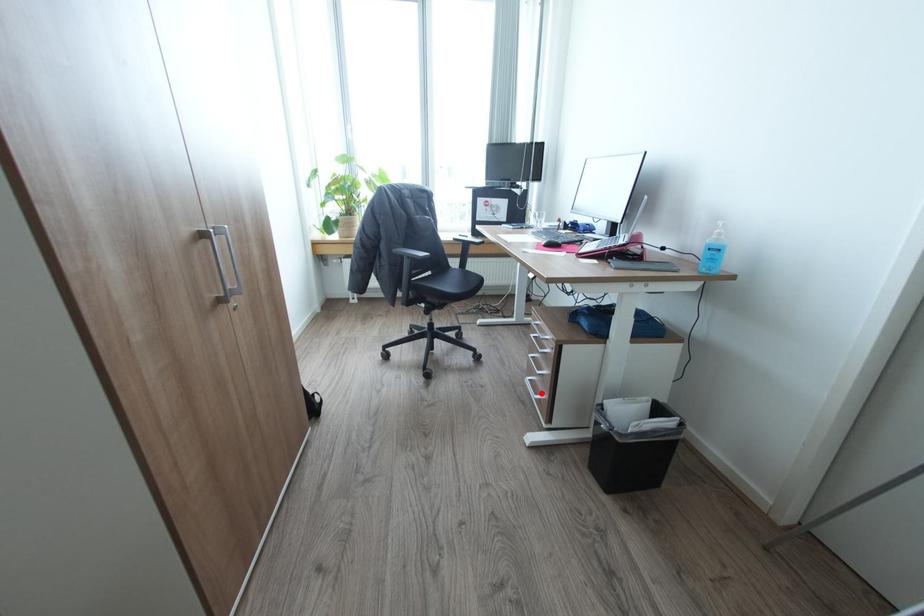
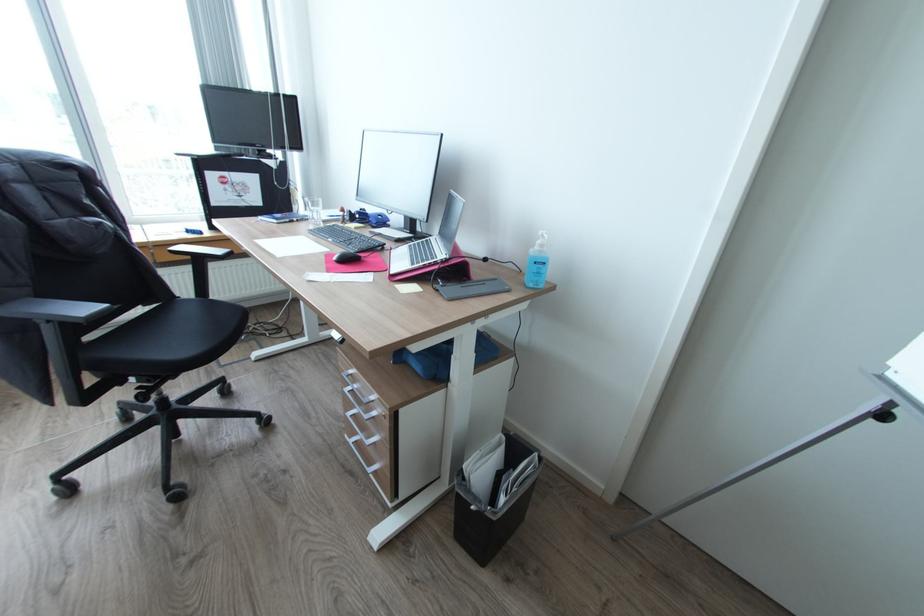
Find the pixel in the second image that matches the highlighted location in the first image.

(373, 464)